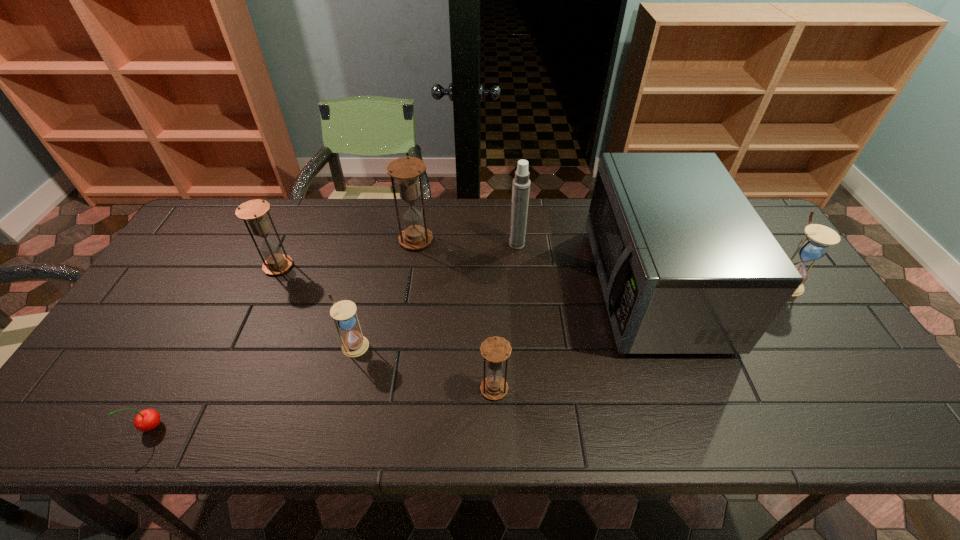
In order to click on the smaller white hourglass in this screenshot , I will do `click(354, 344)`.

Locate an element on the screen. The image size is (960, 540). the fourth hourglass from left to right is located at coordinates (495, 350).

The image size is (960, 540). I want to click on the second nearest object, so click(495, 350).

At what (x,y) coordinates should I click in order to perform the action: click on the shortest object. Please return your answer as a coordinate pair (x, y). This screenshot has height=540, width=960. Looking at the image, I should click on (146, 420).

Where is `cherry`? cherry is located at coordinates (146, 420).

Locate an element on the screen. free space located on the right of the sixth object from left to right is located at coordinates point(614,245).

The width and height of the screenshot is (960, 540). What are the coordinates of `free space located on the front-facing side of the seventh object from left to right` in the screenshot? It's located at (449, 287).

Locate an element on the screen. free location located on the front-facing side of the seventh object from left to right is located at coordinates (474, 287).

At what (x,y) coordinates should I click in order to perform the action: click on free spot located 0.270m on the front-facing side of the seventh object from left to right. Please return your answer as a coordinate pair (x, y). The width and height of the screenshot is (960, 540). Looking at the image, I should click on (495, 287).

You are a GUI agent. You are given a task and a screenshot of the screen. Output one action in this format:
    pyautogui.click(x=<x>, y=<y>)
    Task: Click on the free space located on the left of the second brown hourglass from left to right
    This screenshot has width=960, height=540.
    Given the screenshot: What is the action you would take?
    pyautogui.click(x=284, y=240)